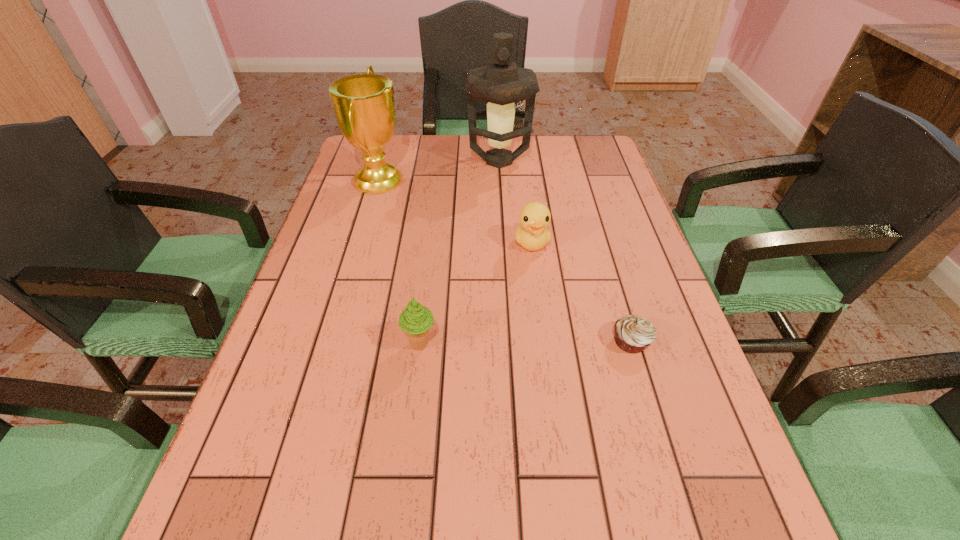
Locate an element on the screen. free space at the right edge of the desktop is located at coordinates (606, 254).

The height and width of the screenshot is (540, 960). In order to click on free space between the icecream and the fourth shortest object in this screenshot , I will do `click(399, 262)`.

Locate an element on the screen. free space between the award and the icecream is located at coordinates (399, 262).

Locate an element on the screen. This screenshot has height=540, width=960. vacant space that's between the duck and the leftmost object is located at coordinates (455, 211).

This screenshot has width=960, height=540. In order to click on vacant space that is in between the icecream and the muffin in this screenshot , I will do `click(525, 343)`.

This screenshot has height=540, width=960. What are the coordinates of `vacant area that lies between the second shortest object and the shortest object` in the screenshot? It's located at (582, 292).

Identify the location of free space between the fourth tallest object and the second tallest object. (455, 211).

The width and height of the screenshot is (960, 540). Identify the location of free space between the second tallest object and the third farthest object. (455, 211).

Where is `vacant space that's between the second shortest object and the muffin`? vacant space that's between the second shortest object and the muffin is located at coordinates (582, 292).

Find the location of `free space between the icecream and the shortest object`. free space between the icecream and the shortest object is located at coordinates (525, 343).